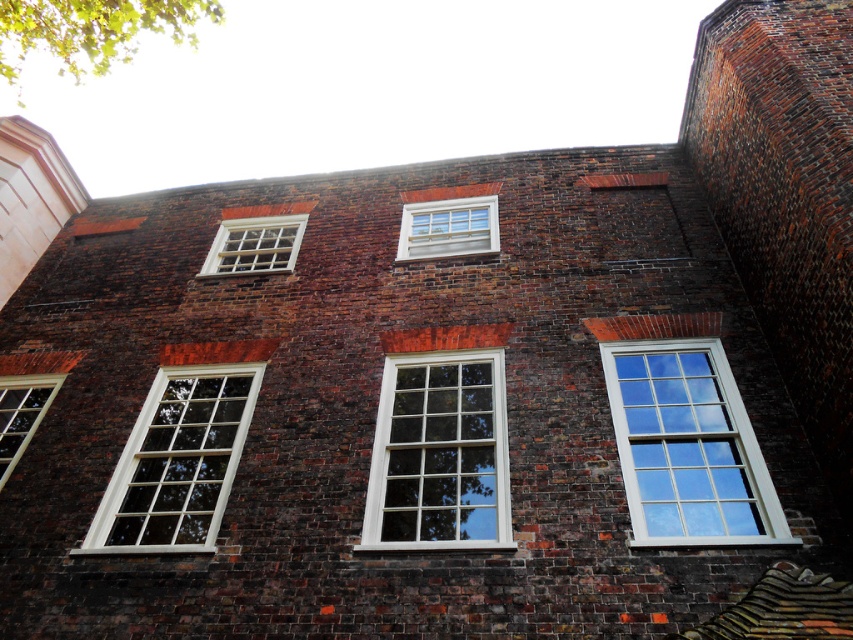
Who is more forward, (492, 540) or (213, 524)?

Point (492, 540) is more forward.

Which of these two, white wood window at center or white wood window at lower left, stands shorter?

white wood window at lower left

Is point (477, 422) closer to viewer compared to point (247, 371)?

Yes, it is.

Locate an element on the screen. Image resolution: width=853 pixels, height=640 pixels. white wood window at center is located at coordinates (439, 454).

Is white wood window at lower left further to the viewer compared to matte white window at lower left?

No, white wood window at lower left is in front of matte white window at lower left.

Which is above, white wood window at lower left or matte white window at lower left?

matte white window at lower left is above.

This screenshot has height=640, width=853. I want to click on white wood window at lower left, so click(177, 461).

How far apart are white wooden window at center and matte white window at lower left?

white wooden window at center is 5.80 meters from matte white window at lower left.

Who is taller, white wooden window at center or matte white window at lower left?

With more height is matte white window at lower left.

Is point (482, 200) closer to viewer compared to point (45, 403)?

No.

Locate an element on the screen. white wooden window at center is located at coordinates (448, 227).